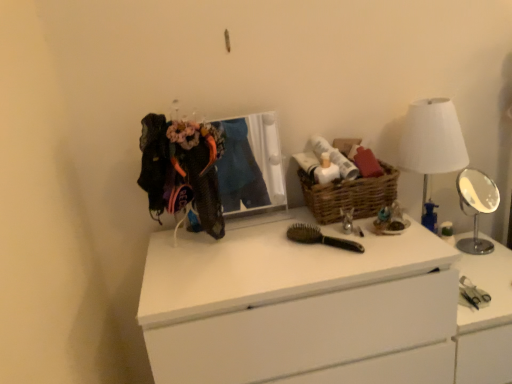
You are a GUI agent. You are given a task and a screenshot of the screen. Output one action in this format:
    pyautogui.click(x=<x>, y=<y>)
    Task: Click on the vacant space situated on the left part of black wooden hairbrush at center
    The height and width of the screenshot is (384, 512).
    Given the screenshot: What is the action you would take?
    pyautogui.click(x=268, y=255)